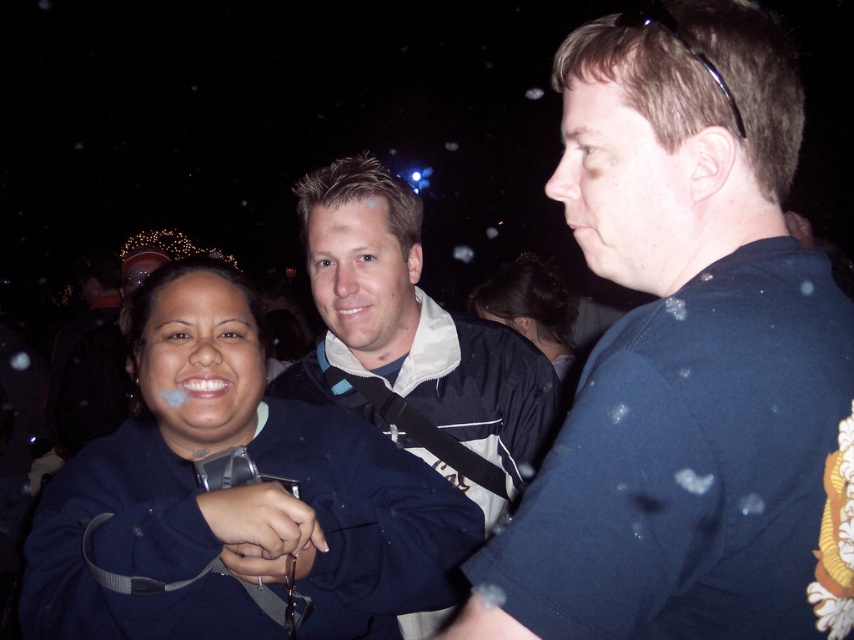
You are a photographer trying to capture a group photo of the dark blue shirt at center and dark brown hair at center. Since you want to ensure both subjects are fully visible, which subject should you adjust the camera frame to prioritize based on their sizes?

The dark blue shirt at center has a smaller width than dark brown hair at center, so you should prioritize framing the dark blue shirt at center to ensure it is fully visible.